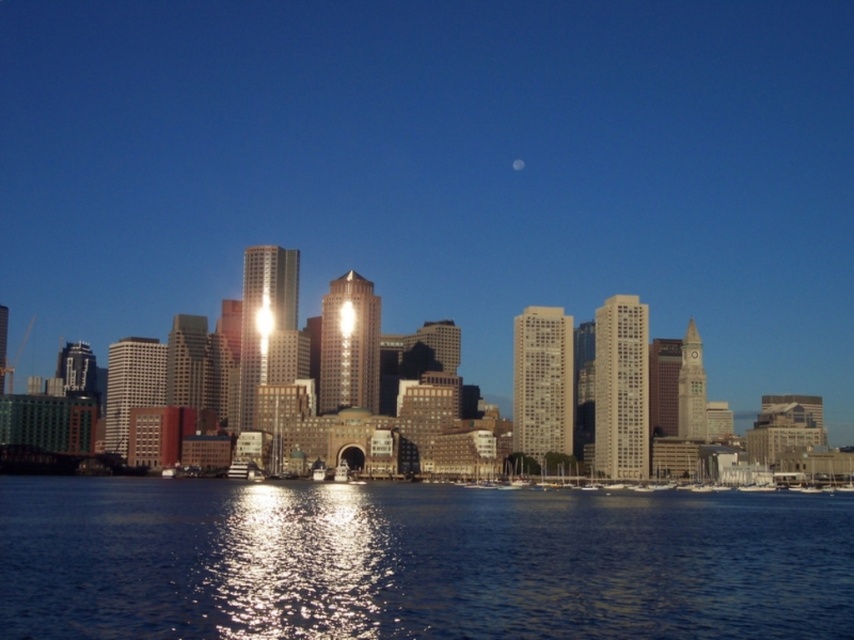
Question: Can you confirm if shiny blue water at lower center is wider than silvery metallic moon at center?

Choices:
 (A) no
 (B) yes

Answer: (B)

Question: Does shiny blue water at lower center have a greater width compared to silvery metallic moon at center?

Choices:
 (A) yes
 (B) no

Answer: (A)

Question: Where is shiny blue water at lower center located in relation to silvery metallic moon at center in the image?

Choices:
 (A) right
 (B) left

Answer: (A)

Question: Which point is farther to the camera?

Choices:
 (A) shiny blue water at lower center
 (B) silvery metallic moon at center

Answer: (B)

Question: Which point is farther to the camera?

Choices:
 (A) (264, 563)
 (B) (340, 324)

Answer: (B)